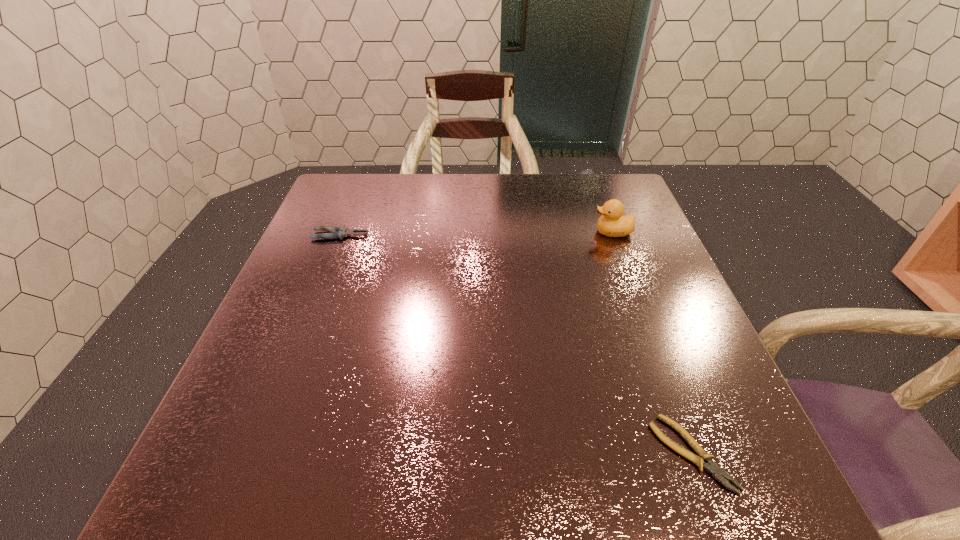
Where is `object located in the near edge section of the desktop`? The height and width of the screenshot is (540, 960). object located in the near edge section of the desktop is located at coordinates (717, 472).

Where is `object situated at the left edge`? The image size is (960, 540). object situated at the left edge is located at coordinates (339, 232).

The height and width of the screenshot is (540, 960). What are the coordinates of `duckling that is at the right edge` in the screenshot? It's located at [x=611, y=224].

Where is `pliers present at the right edge`? Image resolution: width=960 pixels, height=540 pixels. pliers present at the right edge is located at coordinates (717, 472).

The width and height of the screenshot is (960, 540). Identify the location of object that is at the near right corner. (717, 472).

Where is `blank space at the far edge of the desktop`? The width and height of the screenshot is (960, 540). blank space at the far edge of the desktop is located at coordinates (492, 192).

In the image, there is a desktop. In order to click on blank space at the near edge in this screenshot , I will do `click(417, 471)`.

Identify the location of free point at the left edge. (293, 426).

The width and height of the screenshot is (960, 540). I want to click on vacant region at the right edge of the desktop, so click(605, 252).

This screenshot has height=540, width=960. Find the location of `vacant space at the far left corner`. vacant space at the far left corner is located at coordinates (332, 212).